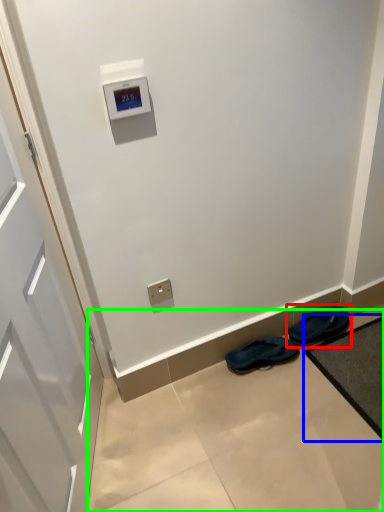
Question: Which object is the farthest from footwear (highlighted by a red box)? Choose among these: bath mat (highlighted by a blue box) or concrete (highlighted by a green box).

Choices:
 (A) bath mat
 (B) concrete

Answer: (B)